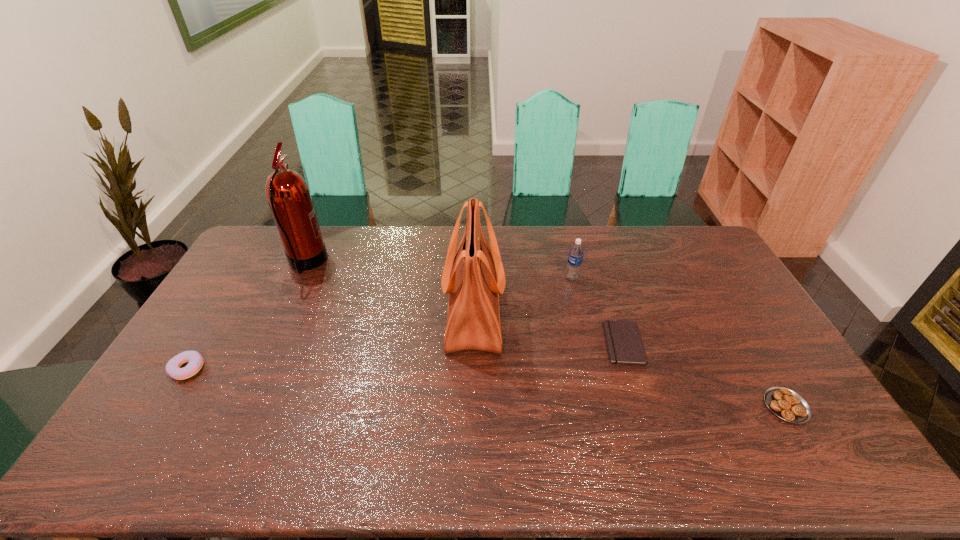
This screenshot has height=540, width=960. Identify the location of vacant area at the far edge. (353, 249).

Where is `vacant position at the near edge of the desktop`? This screenshot has width=960, height=540. vacant position at the near edge of the desktop is located at coordinates (228, 470).

This screenshot has width=960, height=540. I want to click on free space at the right edge of the desktop, so click(x=740, y=359).

Where is `vacant region at the far right corner of the desktop`? The width and height of the screenshot is (960, 540). vacant region at the far right corner of the desktop is located at coordinates (694, 256).

This screenshot has height=540, width=960. What are the coordinates of `empty space between the pastry and the third object from right to left` in the screenshot? It's located at (679, 342).

Where is `unoccupied position between the third object from right to left and the fifth object from right to left`? unoccupied position between the third object from right to left and the fifth object from right to left is located at coordinates (439, 271).

At what (x,y) coordinates should I click in order to perform the action: click on vacant region between the nearest object and the fourth shortest object. Please return your answer as a coordinate pair (x, y). Image resolution: width=960 pixels, height=540 pixels. Looking at the image, I should click on (679, 342).

Locate an element on the screen. free space that is in between the shopping bag and the fifth object from right to left is located at coordinates (390, 288).

The width and height of the screenshot is (960, 540). In order to click on unoccupied position between the shortest object and the nearest object in this screenshot , I will do `click(705, 375)`.

The height and width of the screenshot is (540, 960). Identify the location of vacant space that is in between the fifth shortest object and the second object from left to right. (390, 288).